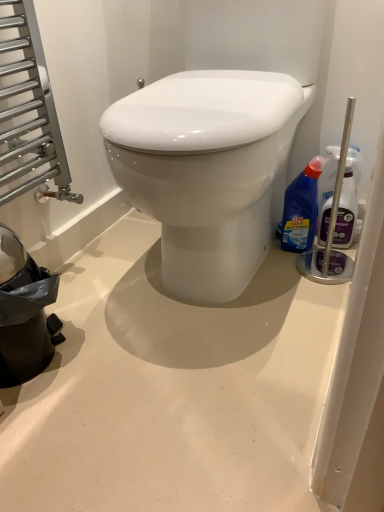
I want to click on vacant space to the left of purple plastic cleaner at right, which appears as the 1th bottle when viewed from the right, so click(x=284, y=263).